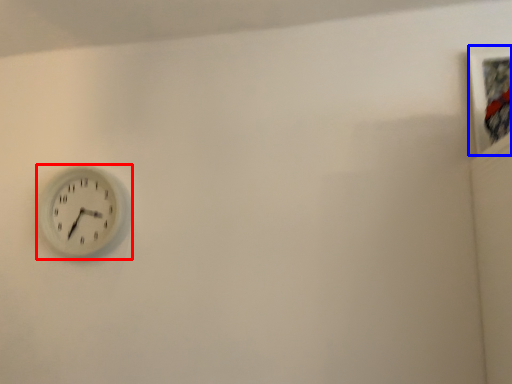
Question: Which object is further to the camera taking this photo, wall clock (highlighted by a red box) or picture frame (highlighted by a blue box)?

Choices:
 (A) wall clock
 (B) picture frame

Answer: (A)